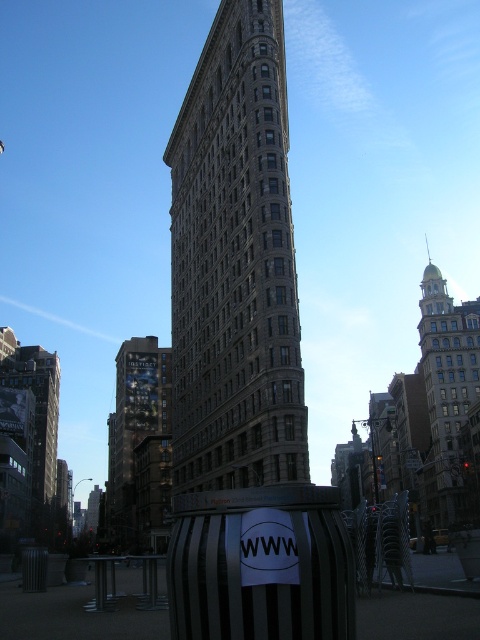
You are an architect analyzing the urban layout. Based on the scene, which building is closer to the observer between the gray stone building at center and the dark gray stone building at left?

The gray stone building at center is closer to the observer because it appears smaller than the dark gray stone building at left, indicating it is farther away. Wait, this is conflicting. Let me think again. Hmm, the description says the gray stone building at center has a smaller size compared to the dark gray stone building at left. So if the dark gray is larger in the image, it might be closer. But perspective can affect size. Hmm, maybe the question is about which is closer based on their sizes. Since,